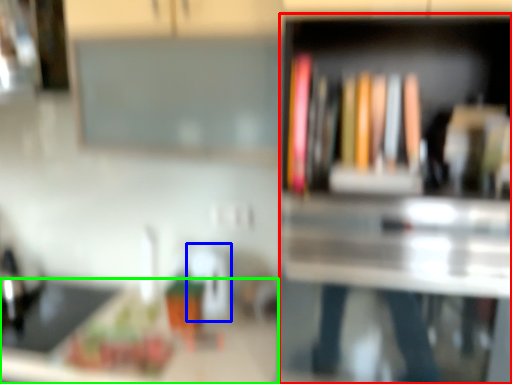
Question: Estimate the real-world distances between objects in this image. Which object is closer to bookshelf (highlighted by a red box), appliance (highlighted by a blue box) or counter top (highlighted by a green box)?

Choices:
 (A) appliance
 (B) counter top

Answer: (B)